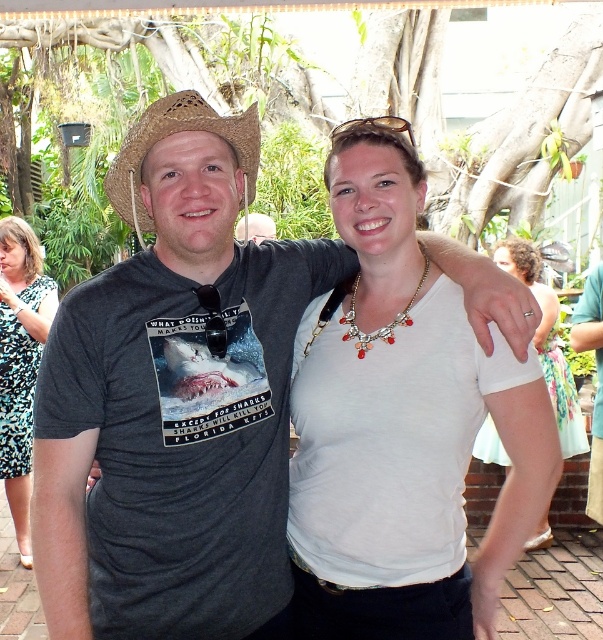
This screenshot has height=640, width=603. Identify the location of dark gray t-shirt at center. (174, 400).

You are a GUI agent. You are given a task and a screenshot of the screen. Output one action in this format:
    pyautogui.click(x=<x>, y=<y>)
    Task: Click on the dark gray t-shirt at center
    This screenshot has height=640, width=603.
    Given the screenshot: What is the action you would take?
    pyautogui.click(x=174, y=400)

In the scene shown: Between dark gray t-shirt at center and printed fabric dress at left, which one appears on the right side from the viewer's perspective?

dark gray t-shirt at center

Is dark gray t-shirt at center closer to the viewer compared to printed fabric dress at left?

Yes.

Is point (144, 376) closer to viewer compared to point (4, 284)?

Yes.

Find the location of a particular element. The width and height of the screenshot is (603, 640). dark gray t-shirt at center is located at coordinates (174, 400).

Can you confirm if dark gray t-shirt at center is thinner than matte gray t-shirt at center?

In fact, dark gray t-shirt at center might be wider than matte gray t-shirt at center.

Which is above, dark gray t-shirt at center or matte gray t-shirt at center?

Positioned higher is matte gray t-shirt at center.

Describe the element at coordinates (174, 400) in the screenshot. I see `dark gray t-shirt at center` at that location.

You are a GUI agent. You are given a task and a screenshot of the screen. Output one action in this format:
    pyautogui.click(x=<x>, y=<y>)
    Task: Click on the dark gray t-shirt at center
    This screenshot has height=640, width=603.
    Given the screenshot: What is the action you would take?
    pyautogui.click(x=174, y=400)